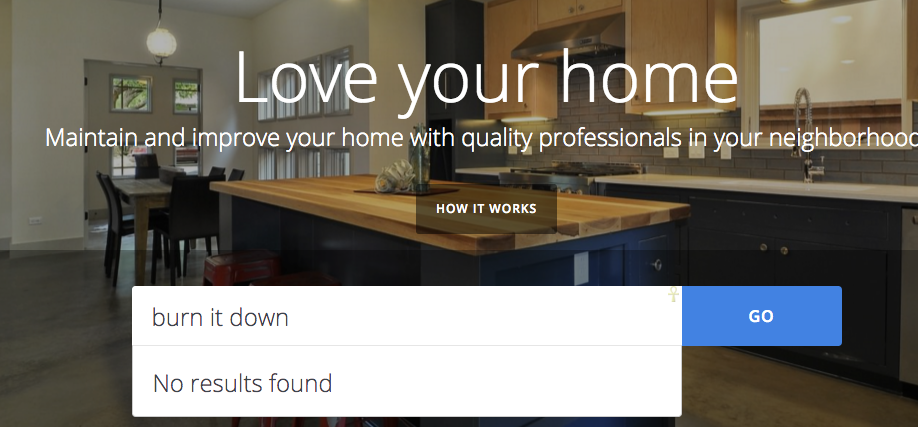
In order to click on kitchen island in this screenshot , I will do `click(383, 214)`.